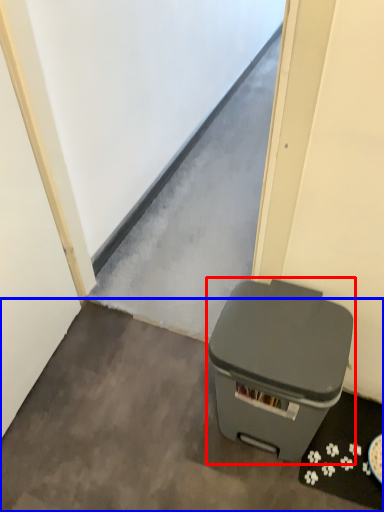
Question: Which point is further to the camera, waste container (highlighted by a red box) or concrete (highlighted by a blue box)?

Choices:
 (A) waste container
 (B) concrete

Answer: (B)